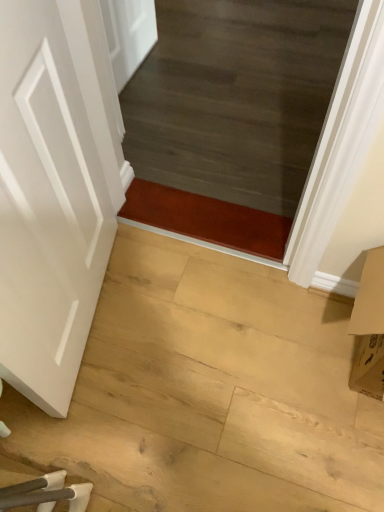
Question: Should I look upward or downward to see transparent glass door at upper center?

Choices:
 (A) down
 (B) up

Answer: (B)